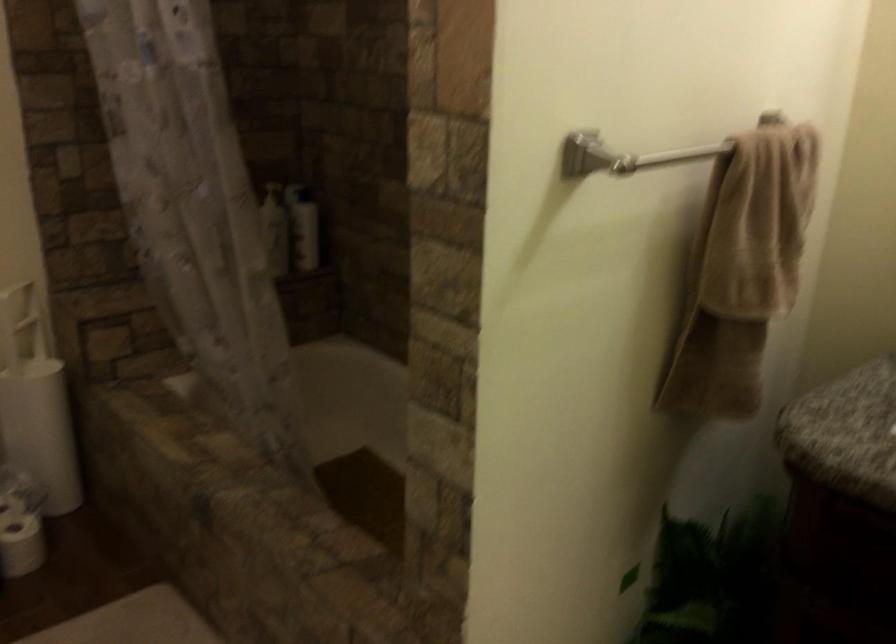
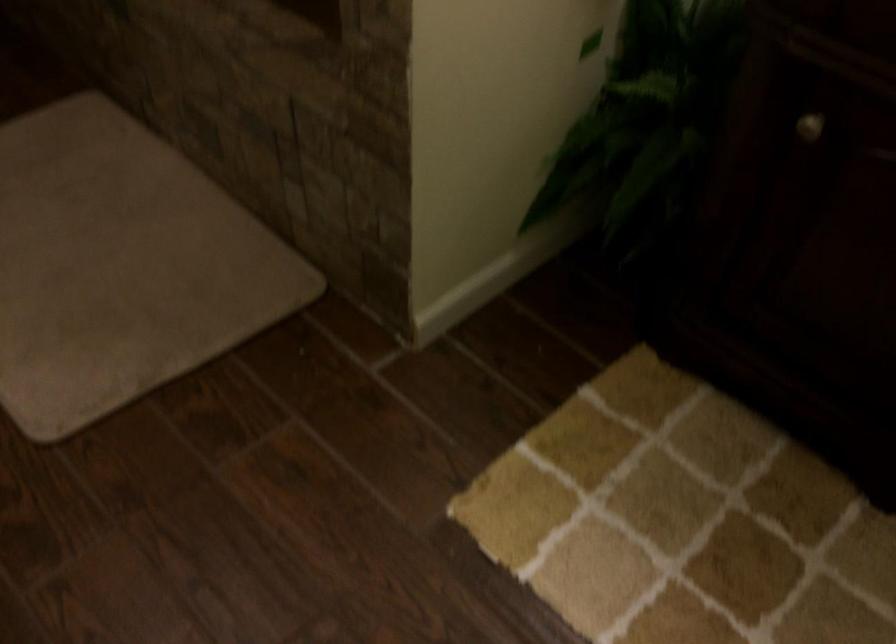
Question: How did the camera likely rotate?

Choices:
 (A) Left
 (B) Right
 (C) Up
 (D) Down

Answer: (D)